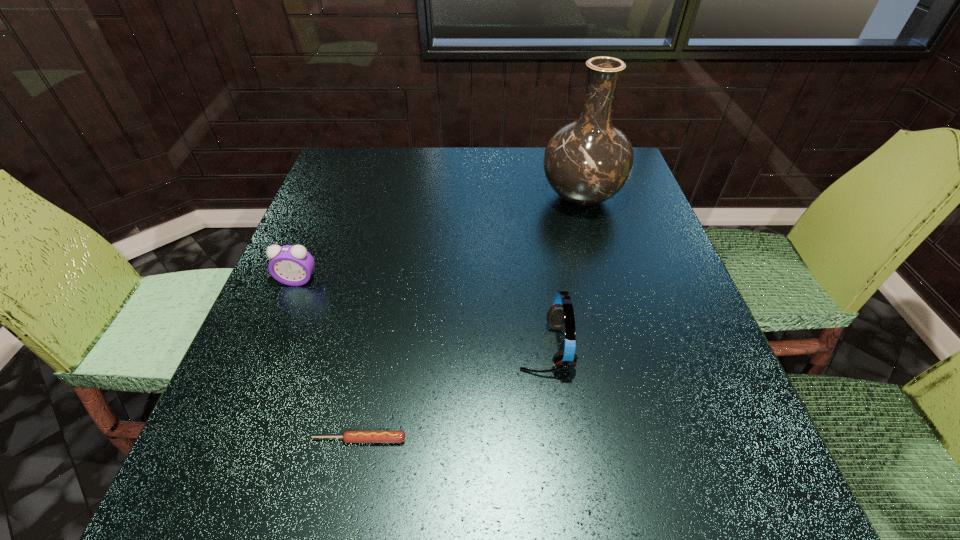
This screenshot has width=960, height=540. Identify the location of vacant point located 0.200m with the microphone attached to the side of the second tallest object. (412, 347).

Locate an element on the screen. This screenshot has width=960, height=540. free space located with the microphone attached to the side of the second tallest object is located at coordinates (481, 347).

Where is `vacant area located 0.350m on the face of the third nearest object`? The height and width of the screenshot is (540, 960). vacant area located 0.350m on the face of the third nearest object is located at coordinates (229, 446).

At what (x,y) coordinates should I click in order to perform the action: click on free spot located 0.100m on the front of the nearest object. Please return your answer as a coordinate pair (x, y). The width and height of the screenshot is (960, 540). Looking at the image, I should click on (345, 514).

Locate an element on the screen. The width and height of the screenshot is (960, 540). object located in the far edge section of the desktop is located at coordinates (586, 162).

Locate an element on the screen. The width and height of the screenshot is (960, 540). object present at the left edge is located at coordinates (292, 265).

The image size is (960, 540). In order to click on object at the right edge in this screenshot , I will do `click(586, 162)`.

Find the location of a particular element. Image resolution: width=960 pixels, height=540 pixels. object at the far right corner is located at coordinates (586, 162).

In the image, there is a desktop. Identify the location of vacant space at the far edge. Image resolution: width=960 pixels, height=540 pixels. (433, 192).

Find the location of `vacant space at the near edge of the desktop`. vacant space at the near edge of the desktop is located at coordinates (557, 467).